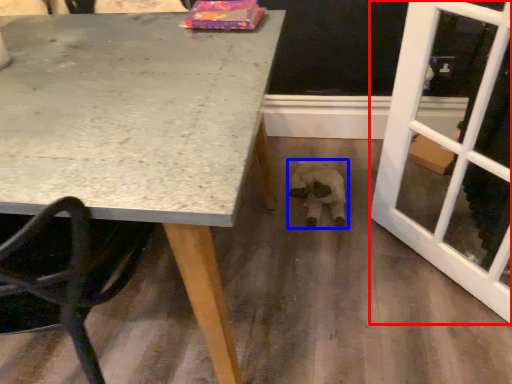
Question: Which object appears closest to the camera in this image, screen door (highlighted by a red box) or animal (highlighted by a blue box)?

Choices:
 (A) screen door
 (B) animal

Answer: (A)